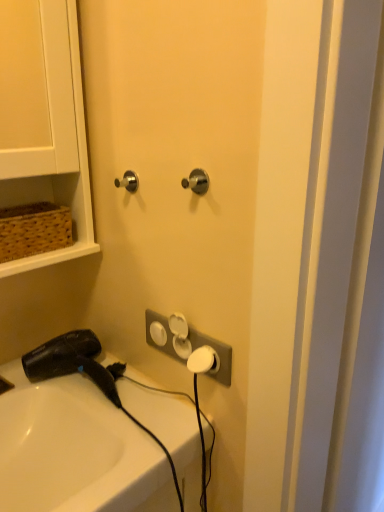
Question: Which is correct: brown woven basket at upper left is inside white glossy sink at lower left, or outside of it?

Choices:
 (A) inside
 (B) outside

Answer: (B)

Question: Does point (41, 266) appear closer or farther from the camera than point (31, 456)?

Choices:
 (A) farther
 (B) closer

Answer: (A)

Question: Based on their relative distances, which object is farther from the brown woven basket at upper left?

Choices:
 (A) white glossy sink at lower left
 (B) black plastic hair dryer at lower left
 (C) white plastic electric outlet at center
 (D) satin nickel knob at center, acting as the first door handle starting from the right
 (E) satin nickel door handle at upper left, the second door handle in the front-to-back sequence

Answer: (A)

Question: Estimate the real-world distances between objects in this image. Which object is farther from the satin nickel knob at center, arranged as the second door handle when viewed from the back?

Choices:
 (A) black plastic hair dryer at lower left
 (B) white plastic electric outlet at center
 (C) satin nickel door handle at upper left, placed as the 1th door handle when sorted from left to right
 (D) white glossy sink at lower left
 (E) brown woven basket at upper left

Answer: (D)